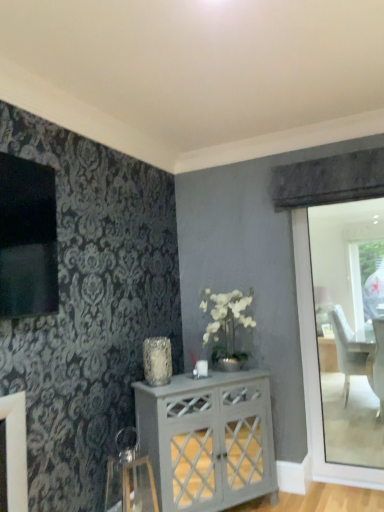
Question: Based on their positions, is white painted wood cabinet at center located to the left or right of metallic silver swivel chair at lower left?

Choices:
 (A) left
 (B) right

Answer: (B)

Question: Is point (246, 441) positioned closer to the camera than point (125, 492)?

Choices:
 (A) farther
 (B) closer

Answer: (A)

Question: Which object is positioned farthest from the white painted wood cabinet at center?

Choices:
 (A) translucent glass vase at center
 (B) metallic silver swivel chair at lower left

Answer: (A)

Question: Considering the real-world distances, which object is closest to the white painted wood cabinet at center?

Choices:
 (A) metallic silver swivel chair at lower left
 (B) translucent glass vase at center

Answer: (A)